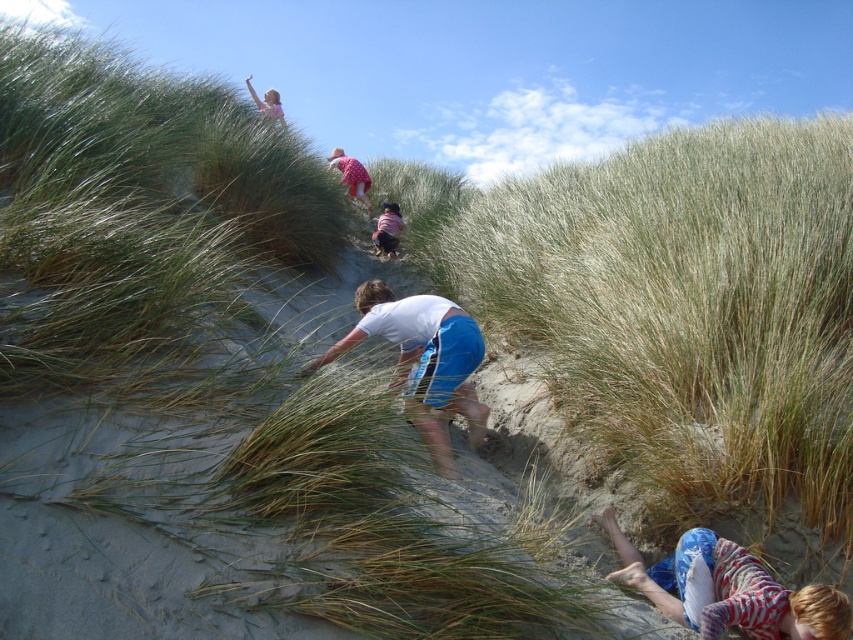
Where is the white cotton shirt at center located in the image?

The white cotton shirt at center is located at point (422, 360) in the image.

Looking at this image, you are standing at the base of the dune and see the white cotton shirt at center and the pink fabric dress at upper center. Which clothing item is positioned to the right of the other?

The white cotton shirt at center is to the right of the pink fabric dress at upper center.

You are a photographer trying to capture a group photo of the white cotton shirt at center and the dark purple shirt at center. Which person should you position closer to the camera to ensure both appear equally wide in the photo?

Since the white cotton shirt at center is wider than the dark purple shirt at center, you should position the white cotton shirt at center closer to the camera. This adjustment will make both appear equally wide in the photo.